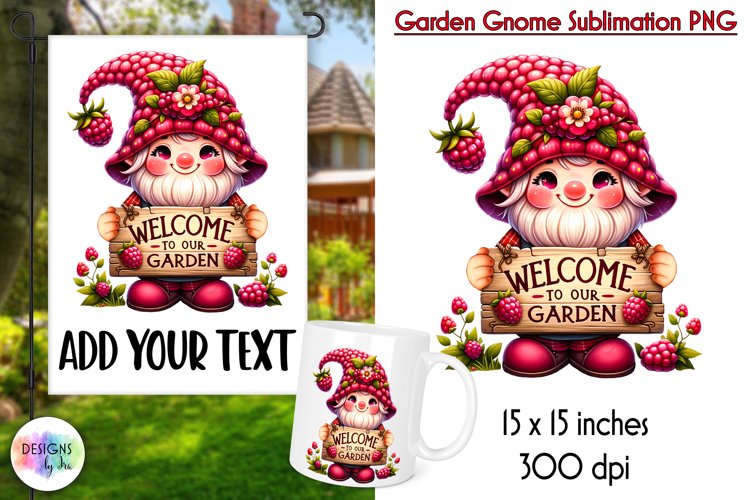
In order to click on mug handle in this screenshot , I will do `click(471, 394)`.